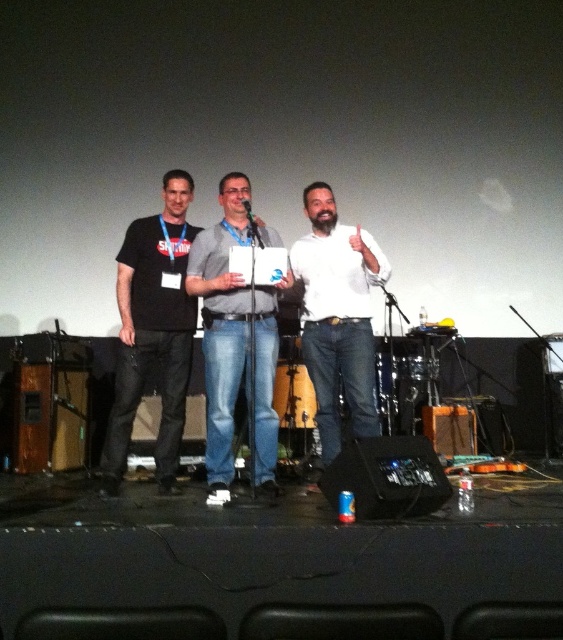
Which is above, black matte t-shirt at left or white matte shirt at center?

black matte t-shirt at left is above.

Measure the distance between point (176,358) and camera.

3.61 meters

Image resolution: width=563 pixels, height=640 pixels. In order to click on black matte t-shirt at left in this screenshot , I will do `click(154, 332)`.

Does gray fabric shirt at center have a smaller size compared to white matte shirt at center?

Incorrect, gray fabric shirt at center is not smaller in size than white matte shirt at center.

Is point (275, 358) closer to viewer compared to point (354, 352)?

No, (275, 358) is behind (354, 352).

Is point (216, 332) less distant than point (360, 324)?

That is True.

Where is `gray fabric shirt at center`? This screenshot has width=563, height=640. gray fabric shirt at center is located at coordinates (222, 323).

Does black matte t-shirt at left have a greater width compared to gray fabric shirt at center?

No.

The width and height of the screenshot is (563, 640). What are the coordinates of `black matte t-shirt at left` in the screenshot? It's located at (154, 332).

The width and height of the screenshot is (563, 640). Find the location of `black matte t-shirt at left`. black matte t-shirt at left is located at coordinates (154, 332).